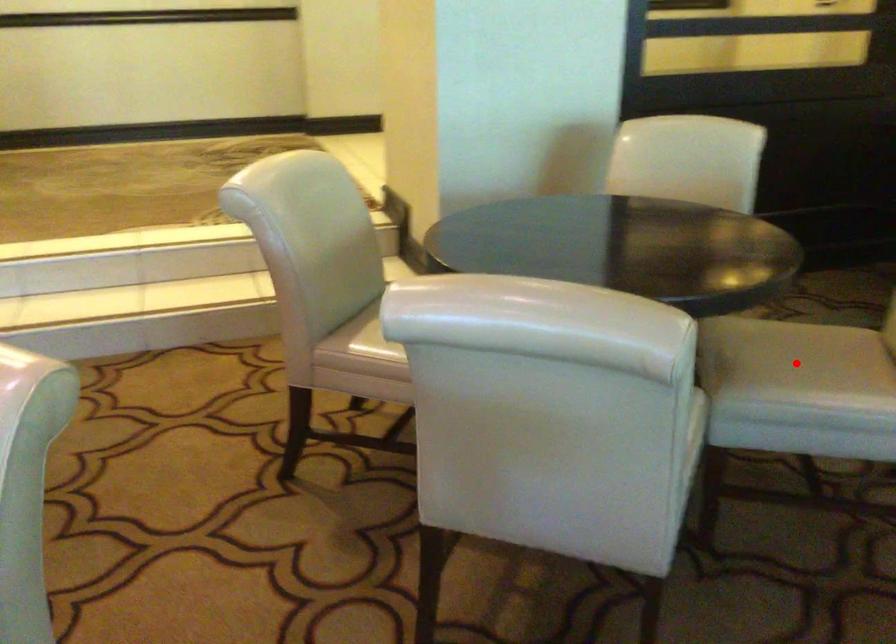
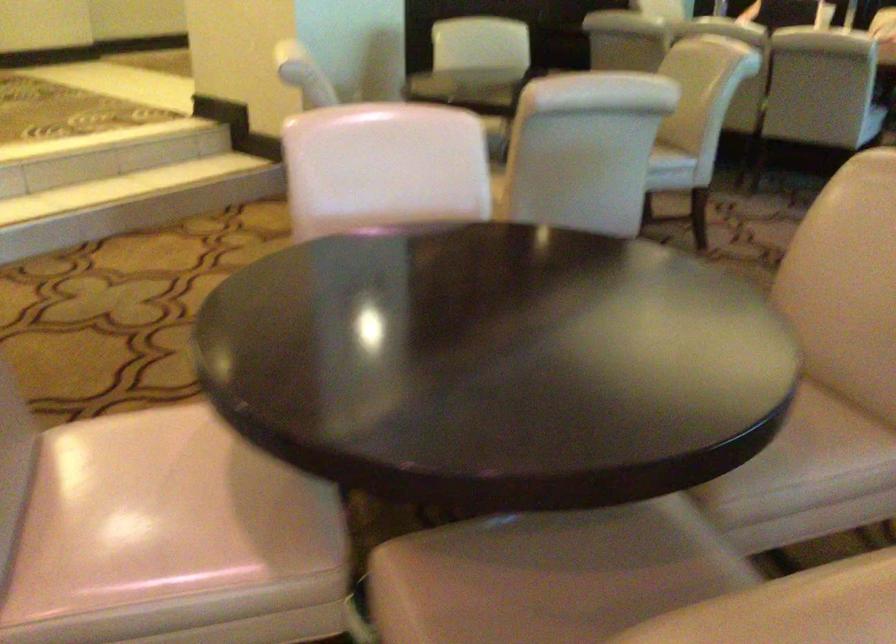
Question: I am providing you with two images of the same scene from different viewpoints. A red point is marked on the first image. Is the red point's position out of view in image 2?

Choices:
 (A) Yes
 (B) No

Answer: (A)